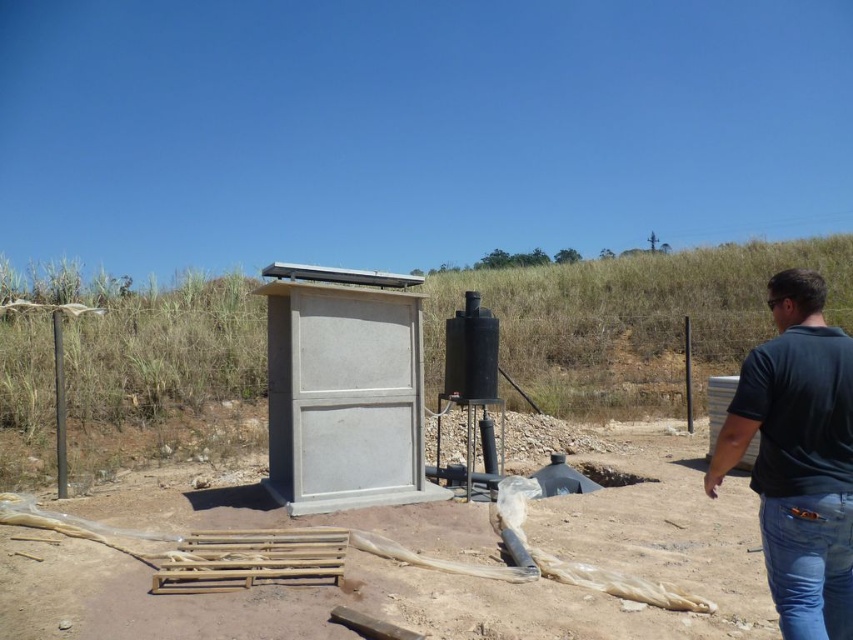
Is dirt at center smaller than dark blue shirt at right?

Indeed, dirt at center has a smaller size compared to dark blue shirt at right.

Where is `dirt at center`? dirt at center is located at coordinates (448, 573).

Is point (809, 621) closer to viewer compared to point (788, 627)?

Yes, it is in front of point (788, 627).

Is dark blue shirt at right taller than blue denim jeans at lower right?

Indeed, dark blue shirt at right has a greater height compared to blue denim jeans at lower right.

Locate an element on the screen. dark blue shirt at right is located at coordinates (798, 458).

Does gray concrete cabinet at center appear under blue denim jeans at lower right?

Actually, gray concrete cabinet at center is above blue denim jeans at lower right.

Which is more to the right, gray concrete cabinet at center or blue denim jeans at lower right?

blue denim jeans at lower right

Locate an element on the screen. This screenshot has width=853, height=640. gray concrete cabinet at center is located at coordinates (343, 388).